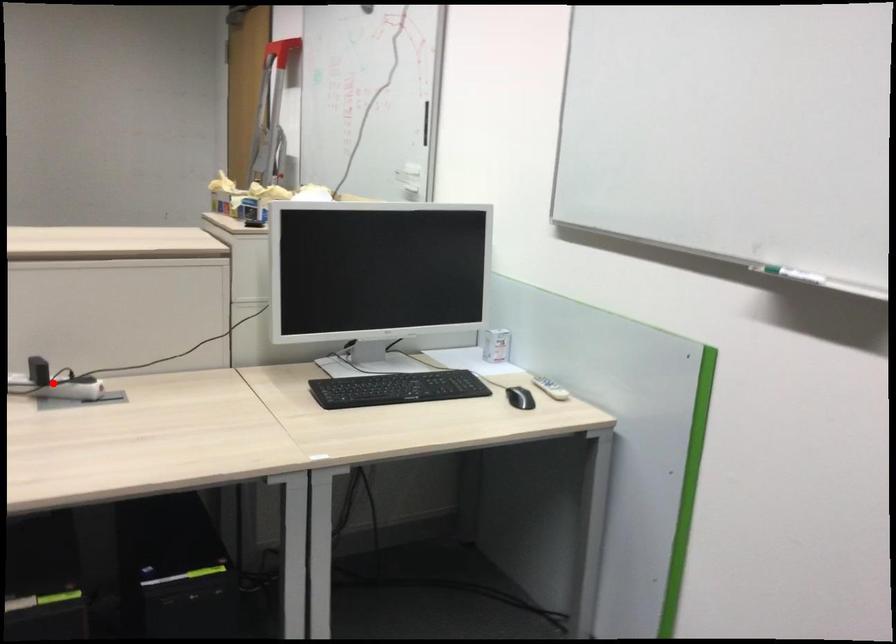
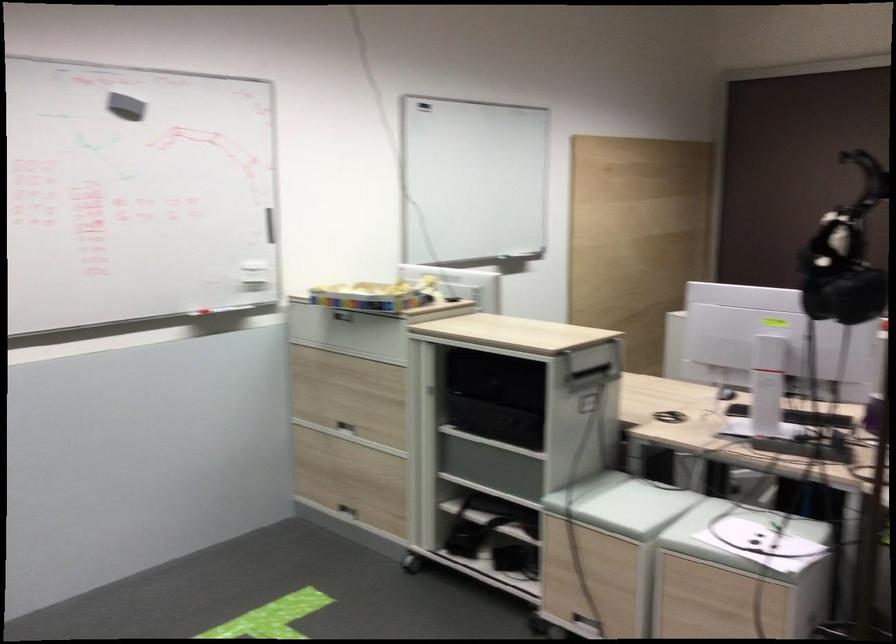
Question: I am providing you with two images of the same scene from different viewpoints. A red point is marked on the first image. Is the red point's position out of view in image 2?

Choices:
 (A) Yes
 (B) No

Answer: (A)